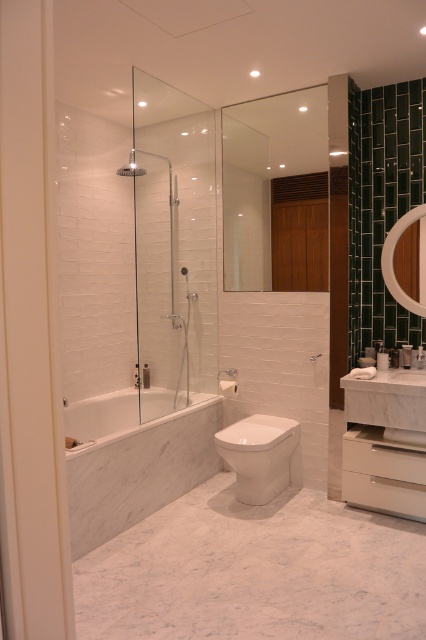
You are standing in the bathroom and want to check the distance to a specific point marked as point (169, 214). Can you estimate how far it is from your current position?

The point (169, 214) is 3.99 meters away from the camera, so it is approximately 4 meters away from your current position.

You are a plumber inspecting a bathroom layout. You need to install a new pipe that connects to both the white marble bathtub at center and the transparent glass shower door at center. Based on their positions, which object is located to the right of the other?

The white marble bathtub at center is positioned on the right side of transparent glass shower door at center, so the white marble bathtub at center is to the right of the transparent glass shower door at center.